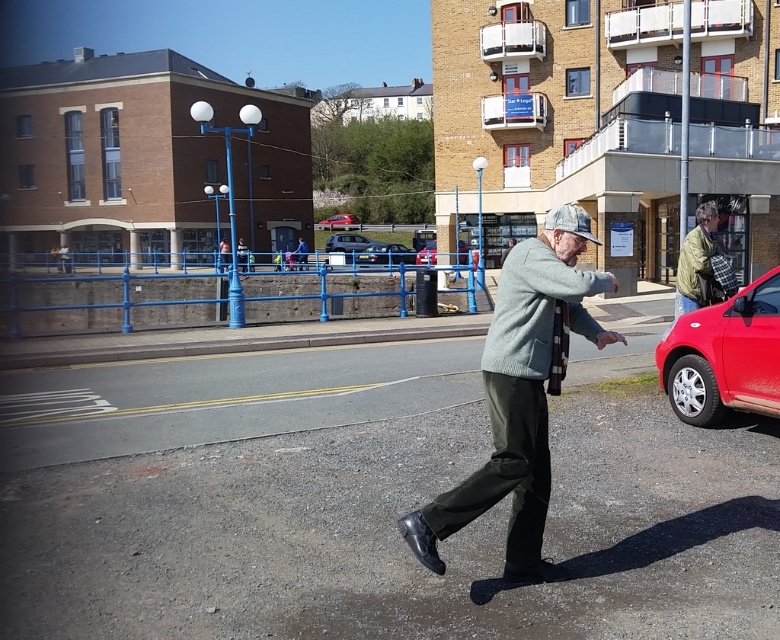
Who is positioned more to the left, green textured jacket at right or metallic gray hatchback at center?

metallic gray hatchback at center is more to the left.

Does green textured jacket at right have a greater width compared to metallic gray hatchback at center?

Indeed, green textured jacket at right has a greater width compared to metallic gray hatchback at center.

Describe the element at coordinates (693, 257) in the screenshot. I see `green textured jacket at right` at that location.

Image resolution: width=780 pixels, height=640 pixels. Identify the location of green textured jacket at right. tap(693, 257).

Can you confirm if shiny red car at right is smaller than metallic silver car at center?

Indeed, shiny red car at right has a smaller size compared to metallic silver car at center.

Between shiny red car at right and metallic silver car at center, which one is positioned lower?

Positioned lower is shiny red car at right.

The width and height of the screenshot is (780, 640). What are the coordinates of `shiny red car at right` in the screenshot? It's located at (724, 355).

Measure the distance between silver metallic hatchback at center and metallic silver car at center.

They are 20.93 feet apart.

In the scene shown: Which is below, silver metallic hatchback at center or metallic silver car at center?

metallic silver car at center is lower down.

Measure the distance between silver metallic hatchback at center and camera.

silver metallic hatchback at center and camera are 47.43 meters apart from each other.

Identify the location of silver metallic hatchback at center. This screenshot has width=780, height=640. (346, 243).